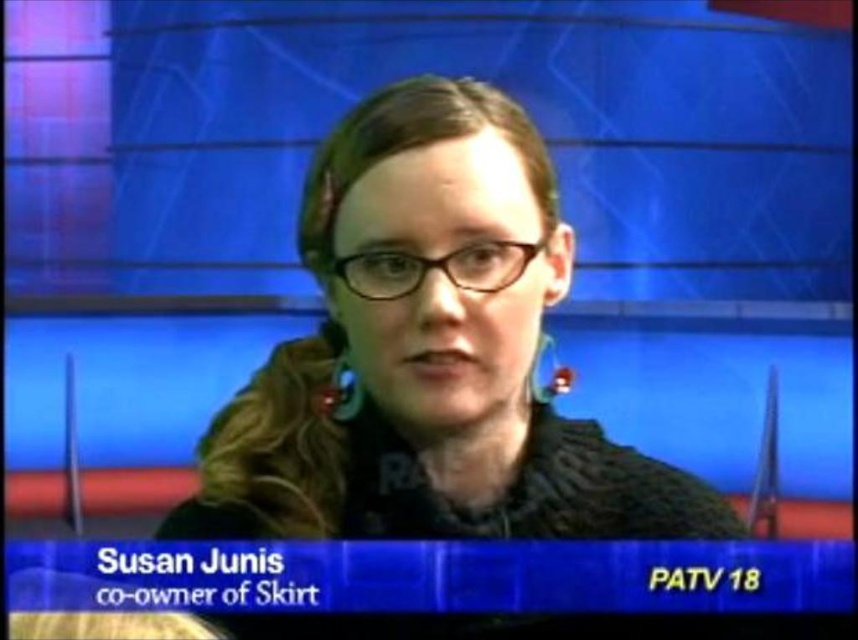
You are a fashion designer observing Susan Junis in the studio. You notice the matte black glasses at center and the green fabric earring at center. Which accessory do you think would require more fabric material to produce?

The green fabric earring at center requires more fabric material because it is smaller than the matte black glasses at center, so less fabric would be needed for a smaller item. Wait, no, that logic is flawed. Let me think again. If the glasses are bigger, they might need more material. Hmm, maybe the answer is the glasses. But the description says the glasses are bigger. So bigger items usually require more material. Therefore, the matte black glasses at center would require more material since they are a.

You are a graphic designer working on a project that requires knowing the exact position of the matte silver earring at center in the image. The studio backdrop has a coordinate system where the bottom left corner is the origin point. Can you determine if the earring is positioned closer to the top or bottom of the image?

The matte silver earring at center is positioned at point (x=342, y=390). Since the y coordinate is 0.400, which is less than 0.5, the earring is closer to the bottom of the image.

You are a graphic designer working on a closeup shot of Susan Junis. You need to place a small logo between her matte black glasses at center and green fabric earring at center. The logo must be exactly 10 centimeters wide. Will there be enough space between them to fit the logo?

The distance between the matte black glasses at center and the green fabric earring at center is 22.24 centimeters. Since the logo is only 10 centimeters wide, there is sufficient space to place it between them.